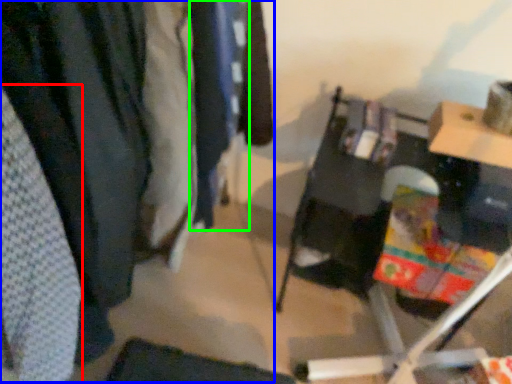
Question: Considering the real-world distances, which object is closest to clothing (highlighted by a red box)? closet (highlighted by a blue box) or clothing (highlighted by a green box).

Choices:
 (A) closet
 (B) clothing

Answer: (A)